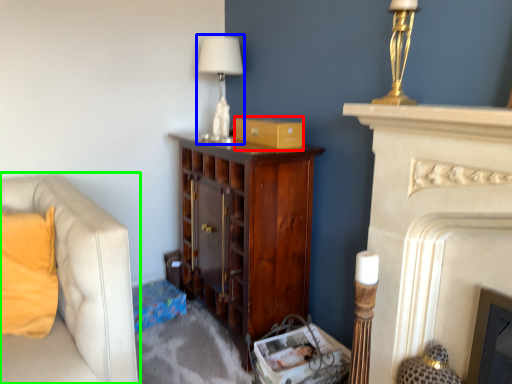
Question: Which object is the farthest from cardboard box (highlighted by a red box)? Choose among these: table lamp (highlighted by a blue box) or studio couch (highlighted by a green box).

Choices:
 (A) table lamp
 (B) studio couch

Answer: (B)